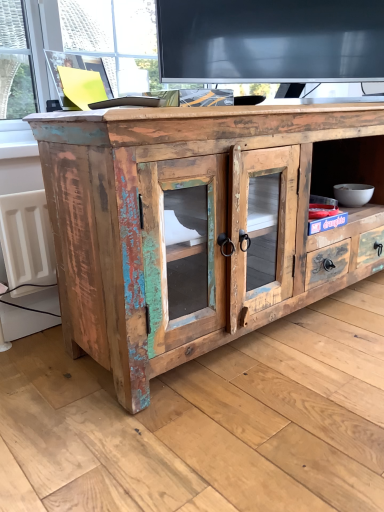
Question: Is distressed wood cabinet at center in front of or behind white plastic radiator at left in the image?

Choices:
 (A) behind
 (B) front

Answer: (B)

Question: From the image's perspective, is distressed wood cabinet at center positioned above or below white plastic radiator at left?

Choices:
 (A) above
 (B) below

Answer: (A)

Question: From a real-world perspective, relative to white plastic radiator at left, is distressed wood cabinet at center vertically above or below?

Choices:
 (A) above
 (B) below

Answer: (A)

Question: Looking at their shapes, would you say white plastic radiator at left is wider or thinner than distressed wood cabinet at center?

Choices:
 (A) thin
 (B) wide

Answer: (A)

Question: Choose the correct answer: Is white plastic radiator at left inside distressed wood cabinet at center or outside it?

Choices:
 (A) inside
 (B) outside

Answer: (B)

Question: Based on their positions, is white plastic radiator at left located to the left or right of distressed wood cabinet at center?

Choices:
 (A) right
 (B) left

Answer: (B)

Question: Is point click(x=4, y=218) positioned closer to the camera than point click(x=251, y=208)?

Choices:
 (A) closer
 (B) farther

Answer: (A)